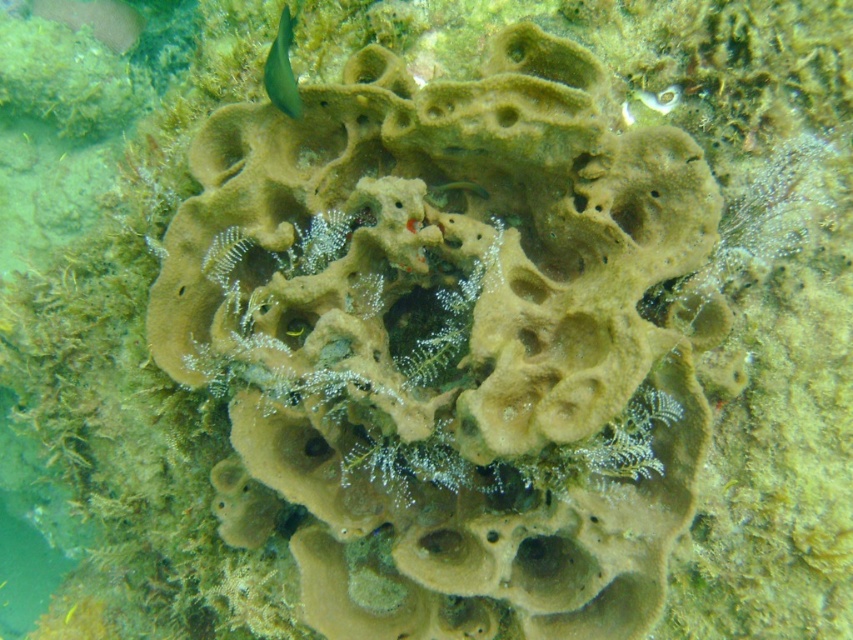
Question: Can you confirm if green matte fish at upper left is thinner than green matte fish at center?

Choices:
 (A) no
 (B) yes

Answer: (A)

Question: Can you confirm if green matte fish at upper left is thinner than green matte fish at center?

Choices:
 (A) yes
 (B) no

Answer: (B)

Question: Does green matte fish at upper left have a larger size compared to green matte fish at center?

Choices:
 (A) no
 (B) yes

Answer: (B)

Question: Which point is closer to the camera?

Choices:
 (A) (271, 65)
 (B) (473, 192)

Answer: (A)

Question: Which point is farther to the camera?

Choices:
 (A) green matte fish at center
 (B) green matte fish at upper left

Answer: (A)